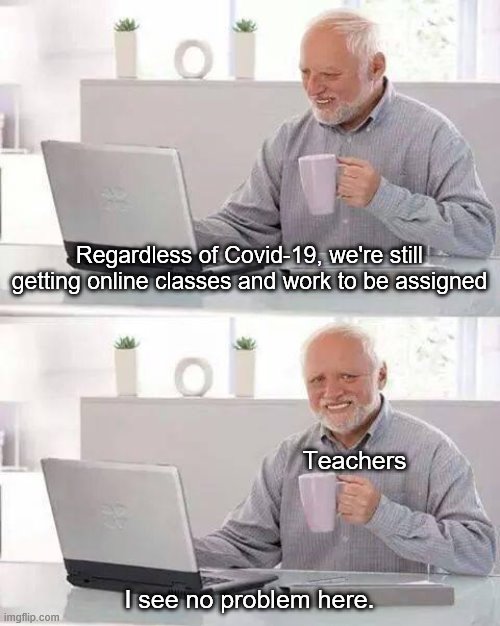
I want to click on keyboard, so click(207, 577), click(211, 264).